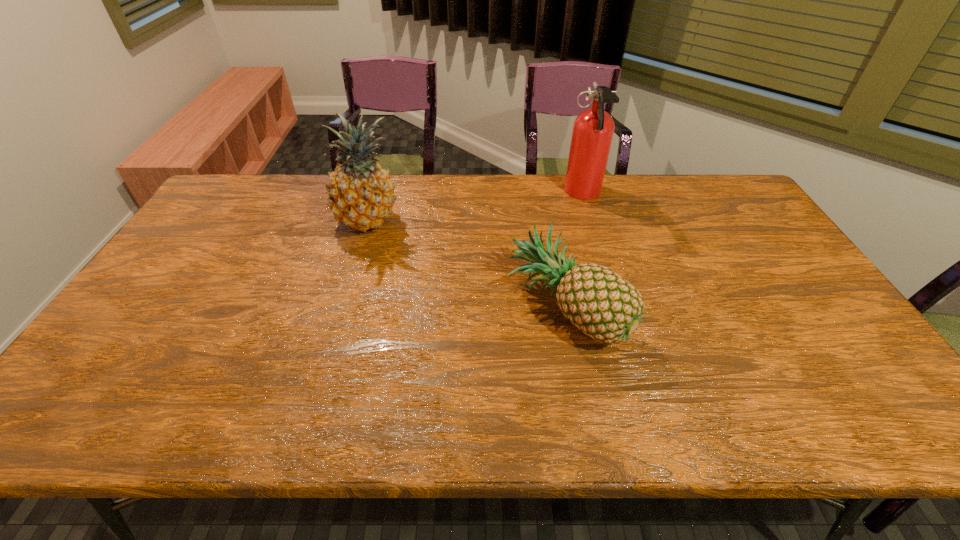
Find the location of a particular element. Image resolution: width=960 pixels, height=540 pixels. unoccupied area between the nearest object and the fire extinguisher is located at coordinates (574, 251).

Identify the location of vacant region between the shorter pineapple and the left pineapple. The width and height of the screenshot is (960, 540). (467, 265).

I want to click on vacant area that lies between the shorter pineapple and the left pineapple, so click(467, 265).

What are the coordinates of `unoccupied position between the shortest object and the fire extinguisher` in the screenshot? It's located at (574, 251).

Locate which object ranks in proximity to the left pineapple. Please provide its 2D coordinates. Your answer should be formatted as a tuple, i.e. [(x, y)], where the tuple contains the x and y coordinates of a point satisfying the conditions above.

[(603, 305)]

Where is `object that stands as the second closest to the fire extinguisher`? The width and height of the screenshot is (960, 540). object that stands as the second closest to the fire extinguisher is located at coordinates (361, 194).

At what (x,y) coordinates should I click in order to perform the action: click on free space that satisfies the following two spatial constraints: 1. on the back side of the farther pineapple; 2. on the right side of the fire extinguisher. Please return your answer as a coordinate pair (x, y). The width and height of the screenshot is (960, 540). Looking at the image, I should click on (375, 194).

I want to click on vacant space that satisfies the following two spatial constraints: 1. on the front side of the farther pineapple; 2. on the right side of the nearer pineapple, so click(x=341, y=308).